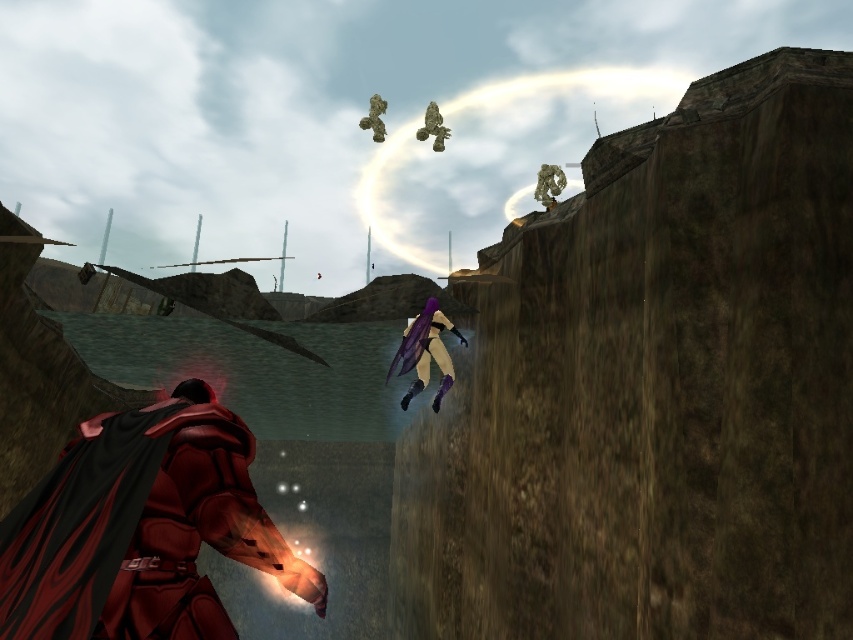
Question: Is shiny red armor at center thinner than purple matte wings at center?

Choices:
 (A) yes
 (B) no

Answer: (B)

Question: Which point is closer to the camera taking this photo?

Choices:
 (A) (434, 406)
 (B) (175, 545)

Answer: (B)

Question: Does shiny red armor at center have a smaller size compared to purple matte wings at center?

Choices:
 (A) yes
 (B) no

Answer: (B)

Question: Which point is closer to the camera?

Choices:
 (A) (155, 529)
 (B) (424, 323)

Answer: (A)

Question: Where is shiny red armor at center located in relation to purple matte wings at center in the image?

Choices:
 (A) right
 (B) left

Answer: (B)